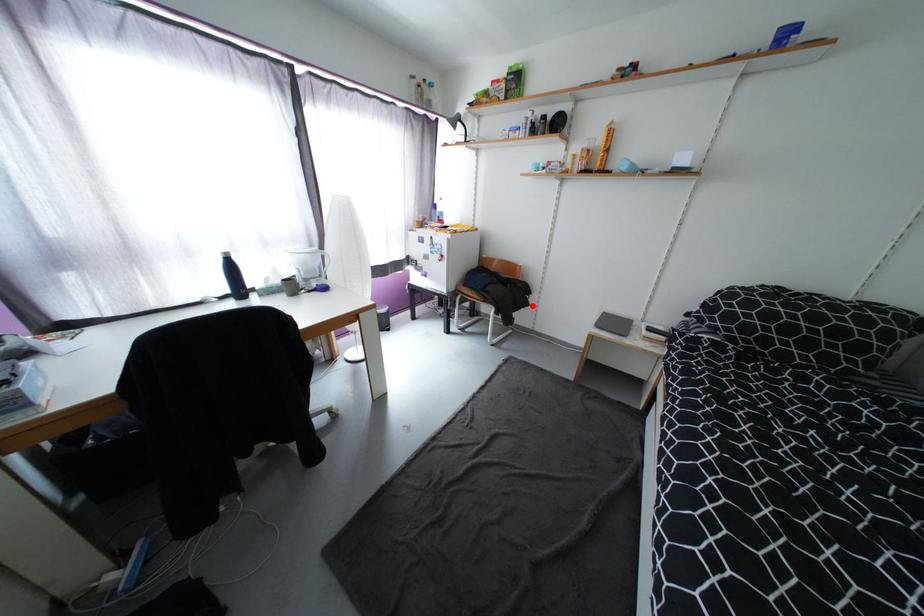
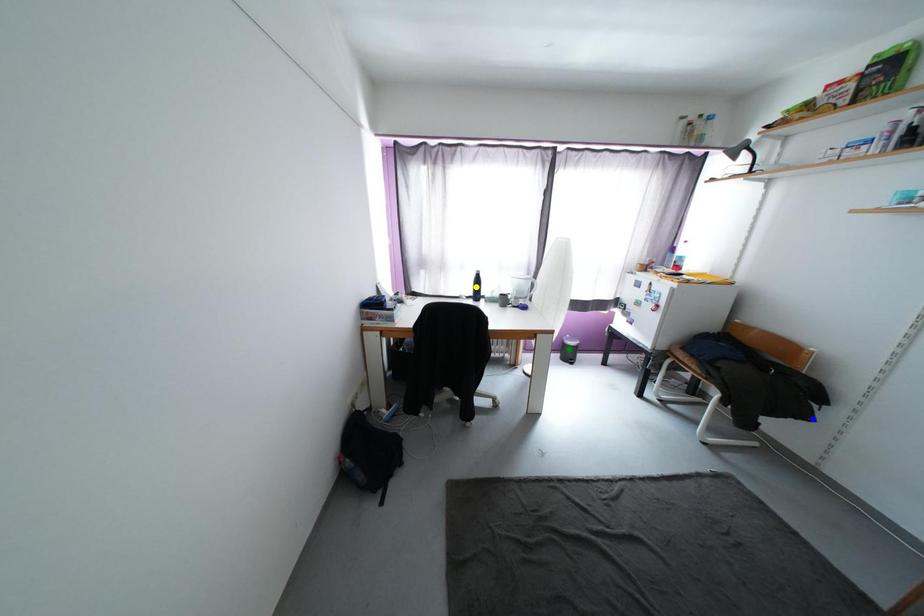
Question: I am providing you with two images of the same scene from different viewpoints. A red point is marked on the first image. You are given multiple points on the second image. Which point in image 2 represents the same 3d spot as the red point in image 1?

Choices:
 (A) yellow point
 (B) green point
 (C) blue point

Answer: (C)